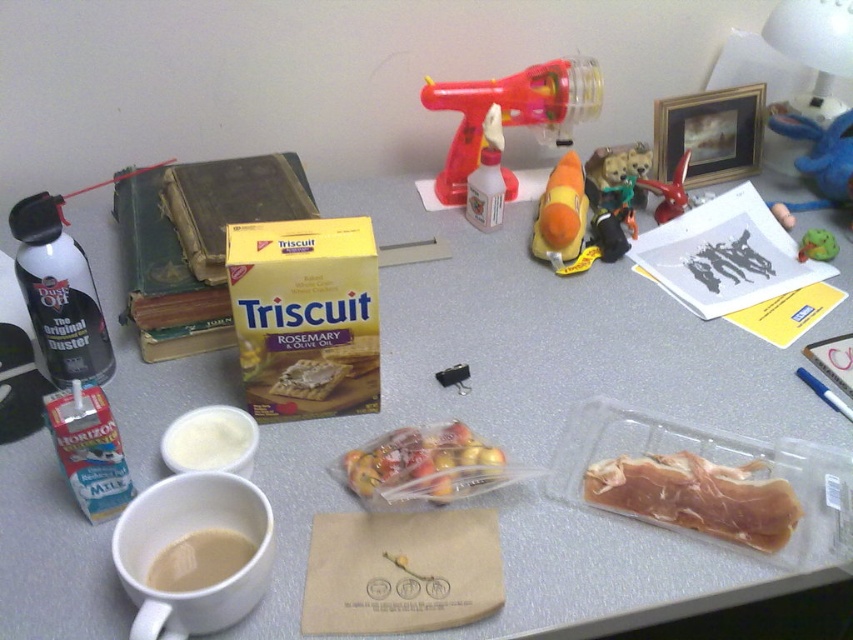
You are organizing the items on the desk and want to place the translucent plastic bag of fruit at center and the plush toy at center into a drawer. Which item will you place first if you want to fit both items into the drawer without removing any other items?

The translucent plastic bag of fruit at center is smaller than the plush toy at center, so you should place the plush toy at center first to ensure there is enough space for the smaller bag afterward.

What is the spatial relationship between the translucent plastic meat at lower right and the other items on the desk?

The translucent plastic meat at lower right is located at point coordinates of (x=698, y=497).